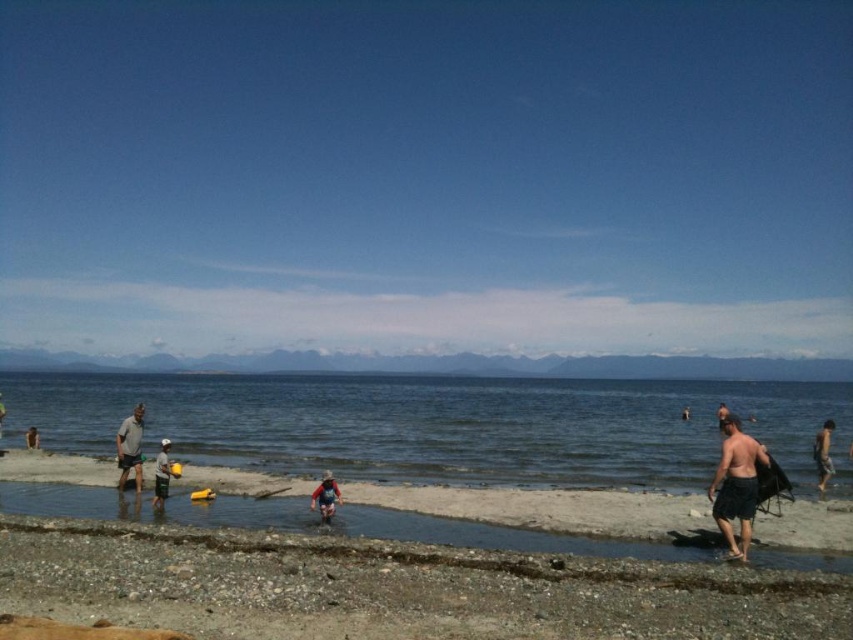
Question: Which of the following is the closest to the observer?

Choices:
 (A) (477, 449)
 (B) (117, 481)

Answer: (B)

Question: In this image, where is red fabric backpack at center located relative to yellow plastic bucket at lower left?

Choices:
 (A) right
 (B) left

Answer: (A)

Question: Observing the image, what is the correct spatial positioning of clear blue water at lower left in reference to yellow plastic bucket at lower left?

Choices:
 (A) above
 (B) below

Answer: (B)

Question: Which point is farther to the camera?

Choices:
 (A) (334, 481)
 (B) (166, 481)
 (C) (556, 515)

Answer: (A)

Question: Among these points, which one is nearest to the camera?

Choices:
 (A) (328, 486)
 (B) (746, 580)
 (C) (741, 435)

Answer: (B)

Question: Observing the image, what is the correct spatial positioning of shiny black shorts at right in reference to red fabric backpack at center?

Choices:
 (A) right
 (B) left

Answer: (A)